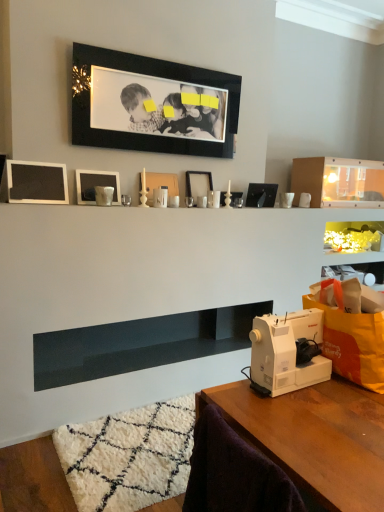
Question: Can we say matte black picture frame at center, positioned as the 2th picture frame in right-to-left order, lies outside white plastic sewing machine at lower right?

Choices:
 (A) yes
 (B) no

Answer: (A)

Question: Is matte black picture frame at center, marked as the fifth picture frame in a left-to-right arrangement, facing towards white plastic sewing machine at lower right?

Choices:
 (A) yes
 (B) no

Answer: (B)

Question: Is matte black picture frame at center, positioned as the 2th picture frame in right-to-left order, smaller than white plastic sewing machine at lower right?

Choices:
 (A) no
 (B) yes

Answer: (B)

Question: Is matte black picture frame at center, marked as the fifth picture frame in a left-to-right arrangement, with white plastic sewing machine at lower right?

Choices:
 (A) yes
 (B) no

Answer: (B)

Question: Considering the relative positions of matte black picture frame at center, marked as the fifth picture frame in a left-to-right arrangement, and white plastic sewing machine at lower right in the image provided, is matte black picture frame at center, marked as the fifth picture frame in a left-to-right arrangement, to the right of white plastic sewing machine at lower right from the viewer's perspective?

Choices:
 (A) yes
 (B) no

Answer: (B)

Question: From the image's perspective, is transparent plastic shelf at upper center, the 2th shelf viewed from the left, positioned above or below matte silver frame at upper center, placed as the second picture frame when sorted from left to right?

Choices:
 (A) below
 (B) above

Answer: (B)

Question: Is transparent plastic shelf at upper center, marked as the 1th shelf in a top-to-bottom arrangement, wider or thinner than matte silver frame at upper center, which appears as the 5th picture frame when viewed from the right?

Choices:
 (A) wide
 (B) thin

Answer: (A)

Question: Is transparent plastic shelf at upper center, which is counted as the first shelf, starting from the right, taller or shorter than matte silver frame at upper center, which appears as the 5th picture frame when viewed from the right?

Choices:
 (A) short
 (B) tall

Answer: (B)

Question: Relative to matte silver frame at upper center, placed as the second picture frame when sorted from left to right, is transparent plastic shelf at upper center, which is counted as the first shelf, starting from the right, in front or behind?

Choices:
 (A) front
 (B) behind

Answer: (B)

Question: From a real-world perspective, is white plastic sewing machine at lower right above or below matte black frame at left, which is the 6th picture frame in right-to-left order?

Choices:
 (A) above
 (B) below

Answer: (B)

Question: Is white plastic sewing machine at lower right inside or outside of matte black frame at left, the 1th picture frame in the left-to-right sequence?

Choices:
 (A) inside
 (B) outside

Answer: (B)

Question: Considering the positions of white plastic sewing machine at lower right and matte black frame at left, which is the 6th picture frame in right-to-left order, in the image, is white plastic sewing machine at lower right bigger or smaller than matte black frame at left, which is the 6th picture frame in right-to-left order,?

Choices:
 (A) small
 (B) big

Answer: (B)

Question: From the image's perspective, is white plastic sewing machine at lower right above or below matte black frame at left, which is the 6th picture frame in right-to-left order?

Choices:
 (A) above
 (B) below

Answer: (B)

Question: Considering the positions of matte black picture frame at center, marked as the fifth picture frame in a left-to-right arrangement, and white plastic sewing machine at lower right in the image, is matte black picture frame at center, marked as the fifth picture frame in a left-to-right arrangement, taller or shorter than white plastic sewing machine at lower right?

Choices:
 (A) tall
 (B) short

Answer: (B)

Question: From the image's perspective, is matte black picture frame at center, marked as the fifth picture frame in a left-to-right arrangement, positioned above or below white plastic sewing machine at lower right?

Choices:
 (A) above
 (B) below

Answer: (A)